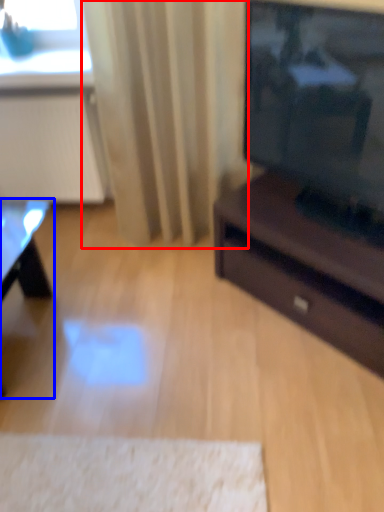
Question: Which object appears closest to the camera in this image, curtain (highlighted by a red box) or table (highlighted by a blue box)?

Choices:
 (A) curtain
 (B) table

Answer: (B)